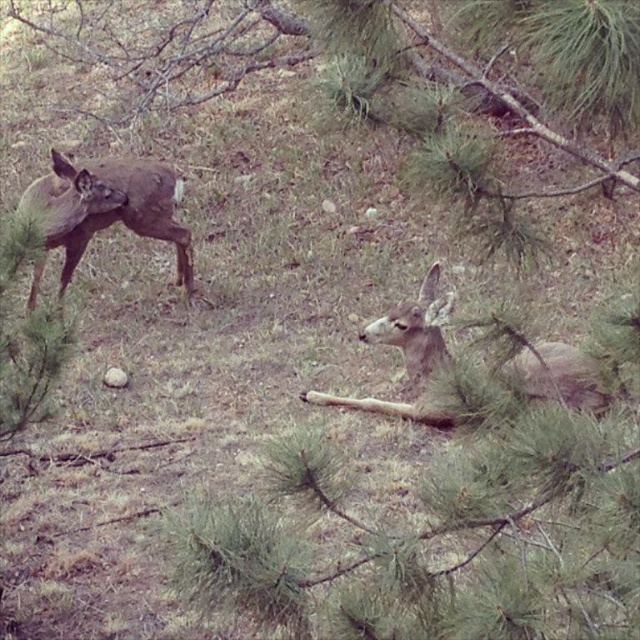
Does fawn fur at lower right have a lesser height compared to brown matte deer at left?

Indeed, fawn fur at lower right has a lesser height compared to brown matte deer at left.

Between fawn fur at lower right and brown matte deer at left, which one is positioned lower?

fawn fur at lower right is below.

Between point (552, 352) and point (67, 205), which one is positioned in front?

Point (552, 352) is more forward.

The height and width of the screenshot is (640, 640). I want to click on fawn fur at lower right, so click(x=408, y=355).